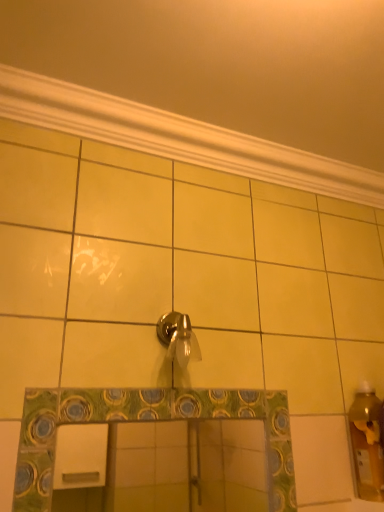
Question: Would you say shiny metallic faucet at center is inside or outside white textured molding at upper center?

Choices:
 (A) outside
 (B) inside

Answer: (A)

Question: Is point (183, 332) closer or farther from the camera than point (64, 106)?

Choices:
 (A) closer
 (B) farther

Answer: (A)

Question: Would you say shiny metallic faucet at center is to the left or to the right of white textured molding at upper center in the picture?

Choices:
 (A) left
 (B) right

Answer: (A)

Question: Considering their positions, is white textured molding at upper center located in front of or behind shiny metallic faucet at center?

Choices:
 (A) front
 (B) behind

Answer: (B)

Question: Is white textured molding at upper center taller or shorter than shiny metallic faucet at center?

Choices:
 (A) short
 (B) tall

Answer: (A)

Question: Looking at their shapes, would you say white textured molding at upper center is wider or thinner than shiny metallic faucet at center?

Choices:
 (A) wide
 (B) thin

Answer: (A)

Question: In the image, is white textured molding at upper center on the left side or the right side of shiny metallic faucet at center?

Choices:
 (A) right
 (B) left

Answer: (A)